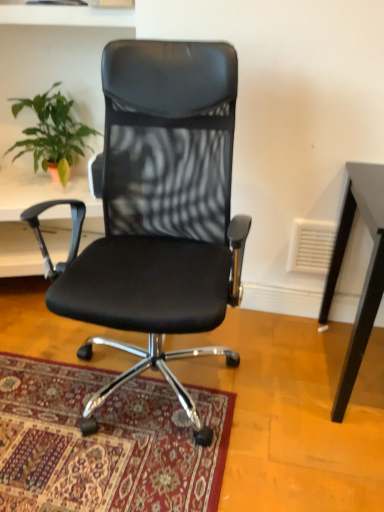
This screenshot has height=512, width=384. What do you see at coordinates (52, 133) in the screenshot?
I see `green leafy plant at upper left` at bounding box center [52, 133].

The width and height of the screenshot is (384, 512). What do you see at coordinates (104, 443) in the screenshot? I see `carpeted rug at center` at bounding box center [104, 443].

You are a GUI agent. You are given a task and a screenshot of the screen. Output one action in this format:
    pyautogui.click(x=<x>, y=<y>)
    Task: Click on the green leafy plant at upper left
    The height and width of the screenshot is (512, 384).
    Given the screenshot: What is the action you would take?
    pyautogui.click(x=52, y=133)

In the scene shown: Which is closer, (38,130) or (157,467)?

The point (157,467) is in front.

Is green leafy plant at upper left located outside carpeted rug at center?

Yes, green leafy plant at upper left is outside of carpeted rug at center.

Looking at this image, from a real-world perspective, is green leafy plant at upper left on carpeted rug at center?

Correct, in the physical world, green leafy plant at upper left is higher than carpeted rug at center.

Who is taller, green leafy plant at upper left or carpeted rug at center?

Standing taller between the two is green leafy plant at upper left.

Do you think black leather office chair at center is within green leafy plant at upper left, or outside of it?

black leather office chair at center lies outside green leafy plant at upper left.

Is black leather office chair at center positioned far away from green leafy plant at upper left?

No, black leather office chair at center is not far away from green leafy plant at upper left.

In the scene shown: Does black leather office chair at center lie behind green leafy plant at upper left?

No, the depth of black leather office chair at center is less than that of green leafy plant at upper left.

Can you confirm if black leather office chair at center is shorter than carpeted rug at center?

No.

Based on their sizes in the image, would you say black leather office chair at center is bigger or smaller than carpeted rug at center?

Clearly, black leather office chair at center is larger in size than carpeted rug at center.

Relative to carpeted rug at center, is black leather office chair at center in front or behind?

black leather office chair at center is in front of carpeted rug at center.

Between black leather office chair at center and carpeted rug at center, which one has smaller width?

With smaller width is black leather office chair at center.

Find the location of a particular element. The width and height of the screenshot is (384, 512). houseplant lying above the black leather office chair at center (from the image's perspective) is located at coordinates (52, 133).

Is green leafy plant at upper left thinner than black leather office chair at center?

Yes, green leafy plant at upper left is thinner than black leather office chair at center.

Consider the image. Does green leafy plant at upper left have a lesser height compared to black leather office chair at center?

Yes, green leafy plant at upper left is shorter than black leather office chair at center.

From the image's perspective, is carpeted rug at center over black leather office chair at center?

No, from the image's perspective, carpeted rug at center is not over black leather office chair at center.

Does carpeted rug at center have a lesser width compared to black leather office chair at center?

No.

The height and width of the screenshot is (512, 384). What are the coordinates of `mat below the black leather office chair at center (from the image's perspective)` in the screenshot? It's located at (104, 443).

From a real-world perspective, who is located higher, carpeted rug at center or black leather office chair at center?

From a 3D spatial view, black leather office chair at center is above.

Can green leafy plant at upper left be found inside carpeted rug at center?

No.

Is carpeted rug at center at the left side of green leafy plant at upper left?

Incorrect, carpeted rug at center is not on the left side of green leafy plant at upper left.

Is carpeted rug at center not near green leafy plant at upper left?

Yes, carpeted rug at center and green leafy plant at upper left are located far from each other.

Considering the relative sizes of carpeted rug at center and green leafy plant at upper left in the image provided, is carpeted rug at center taller than green leafy plant at upper left?

No, carpeted rug at center is not taller than green leafy plant at upper left.

Find the location of a particular element. This screenshot has width=384, height=512. mat below the green leafy plant at upper left (from a real-world perspective) is located at coordinates (104, 443).

You are a GUI agent. You are given a task and a screenshot of the screen. Output one action in this format:
    pyautogui.click(x=<x>, y=<y>)
    Task: Click on the chair on the right of green leafy plant at upper left
    The height and width of the screenshot is (512, 384).
    Given the screenshot: What is the action you would take?
    click(x=159, y=209)

From the image, which object appears to be farther from carpeted rug at center, green leafy plant at upper left or black leather office chair at center?

green leafy plant at upper left lies further to carpeted rug at center than the other object.

From the image, which object appears to be nearer to black leather office chair at center, green leafy plant at upper left or carpeted rug at center?

Among the two, carpeted rug at center is located nearer to black leather office chair at center.

Based on the photo, based on their spatial positions, is carpeted rug at center or green leafy plant at upper left closer to black leather office chair at center?

Based on the image, carpeted rug at center appears to be nearer to black leather office chair at center.

Which object lies nearer to the anchor point green leafy plant at upper left, black leather office chair at center or carpeted rug at center?

black leather office chair at center.

Considering their positions, is black leather office chair at center positioned further to carpeted rug at center than green leafy plant at upper left?

The object further to carpeted rug at center is green leafy plant at upper left.

From the image, which object appears to be nearer to green leafy plant at upper left, carpeted rug at center or black leather office chair at center?

Among the two, black leather office chair at center is located nearer to green leafy plant at upper left.

Where is `chair between green leafy plant at upper left and carpeted rug at center vertically`? chair between green leafy plant at upper left and carpeted rug at center vertically is located at coordinates (159, 209).